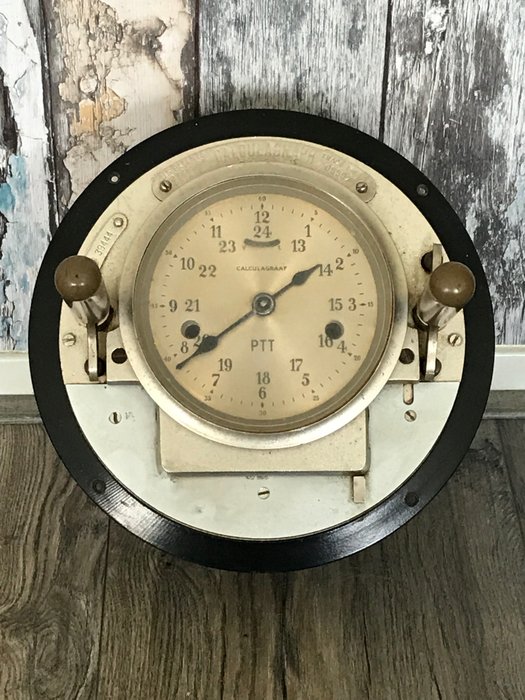
The width and height of the screenshot is (525, 700). What are the coordinates of `screws` in the screenshot? It's located at (457, 339), (364, 186), (167, 188), (114, 413).